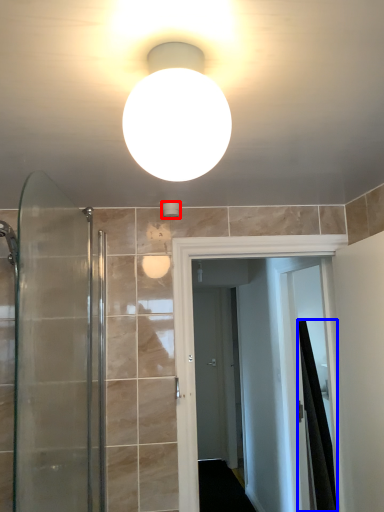
Question: Which object appears farthest to the camera in this image, fixture (highlighted by a red box) or shower curtain (highlighted by a blue box)?

Choices:
 (A) fixture
 (B) shower curtain

Answer: (B)